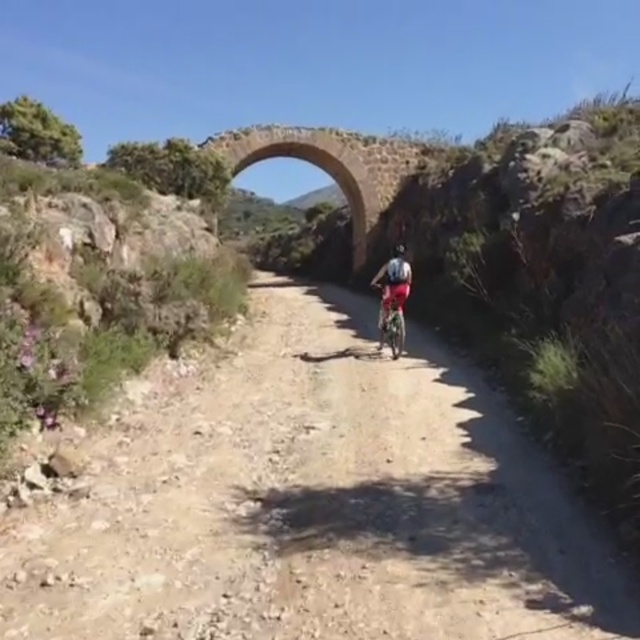
Is dirt path at center thinner than stone archway at center?

No, dirt path at center is not thinner than stone archway at center.

Is dirt path at center in front of stone archway at center?

Yes, dirt path at center is closer to the viewer.

The height and width of the screenshot is (640, 640). I want to click on dirt path at center, so click(312, 502).

At what (x,y) coordinates should I click in order to perform the action: click on dirt path at center. Please return your answer as a coordinate pair (x, y). The height and width of the screenshot is (640, 640). Looking at the image, I should click on (312, 502).

Which of these two, stone archway at center or matte black helmet at center, stands shorter?

stone archway at center is shorter.

Can you confirm if stone archway at center is positioned to the right of matte black helmet at center?

Incorrect, stone archway at center is not on the right side of matte black helmet at center.

You are a GUI agent. You are given a task and a screenshot of the screen. Output one action in this format:
    pyautogui.click(x=<x>, y=<y>)
    Task: Click on the stone archway at center
    
    Given the screenshot: What is the action you would take?
    pyautogui.click(x=332, y=164)

Can you confirm if dirt path at center is positioned above matte black helmet at center?

No, dirt path at center is not above matte black helmet at center.

Is point (128, 492) positioned before point (396, 250)?

Yes, point (128, 492) is in front of point (396, 250).

I want to click on dirt path at center, so click(x=312, y=502).